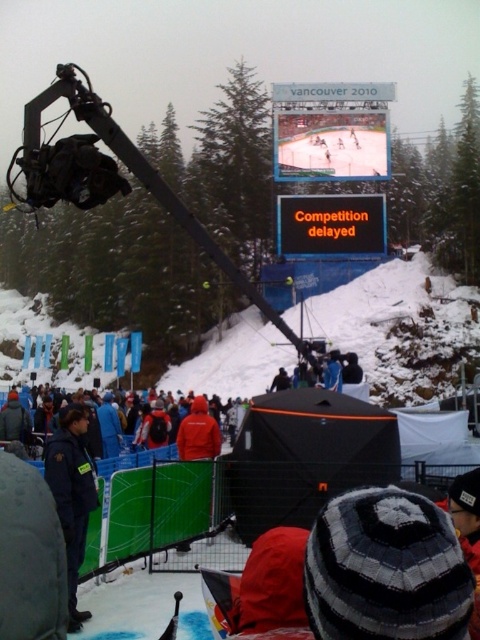
Is point (325, 220) closer to viewer compared to point (217, 454)?

No, it is not.

Which of these two, orange led sign at upper center or red jacket at center, stands shorter?

red jacket at center

I want to click on orange led sign at upper center, so click(x=332, y=225).